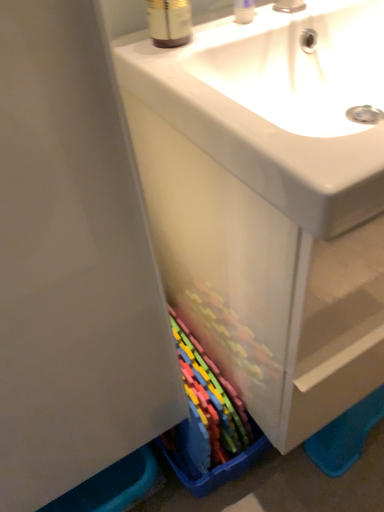
The image size is (384, 512). In order to click on vacant space situated on the left part of clear plastic container at upper center in this screenshot , I will do `click(187, 32)`.